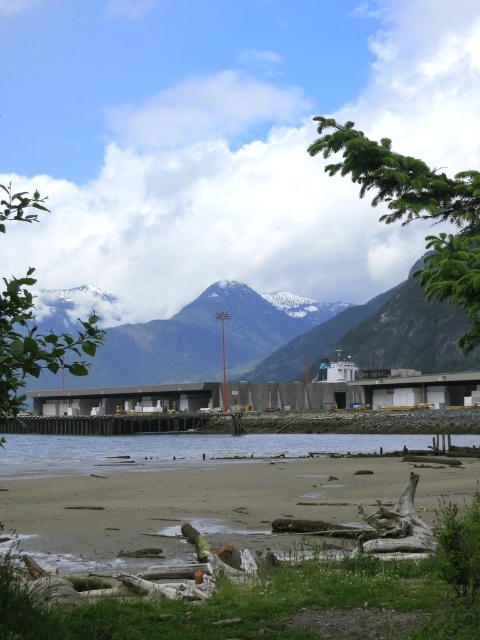
Question: Which point appears closest to the camera in this image?

Choices:
 (A) (26, 465)
 (B) (372, 156)

Answer: (B)

Question: Which object is the farthest from the clear water at lower center?

Choices:
 (A) sandy beach at lower center
 (B) green leafy tree at upper right

Answer: (B)

Question: Which is farther from the sandy beach at lower center?

Choices:
 (A) green leafy tree at upper right
 (B) clear water at lower center

Answer: (A)

Question: Is sandy beach at lower center to the right of green leafy tree at upper right from the viewer's perspective?

Choices:
 (A) yes
 (B) no

Answer: (B)

Question: Does sandy beach at lower center appear on the right side of clear water at lower center?

Choices:
 (A) yes
 (B) no

Answer: (A)

Question: From the image, what is the correct spatial relationship of sandy beach at lower center in relation to clear water at lower center?

Choices:
 (A) right
 (B) left

Answer: (A)